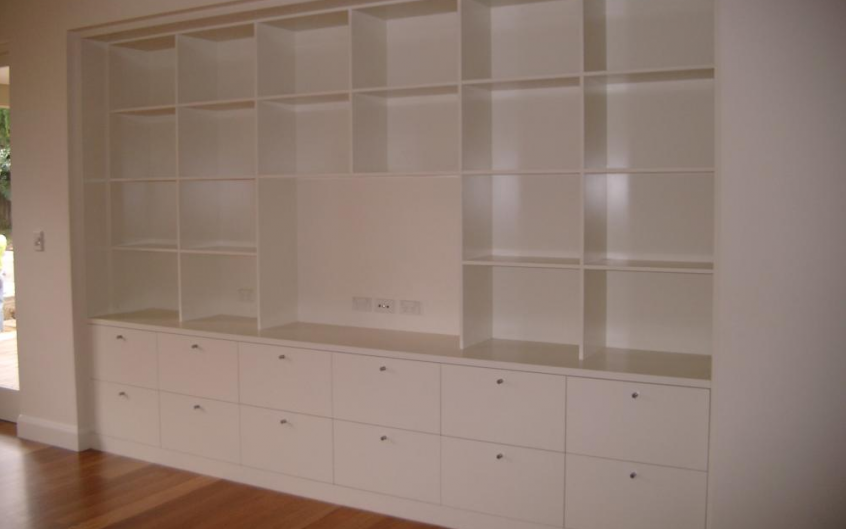
Find the location of a particular element. The height and width of the screenshot is (529, 846). baseboards is located at coordinates (56, 431).